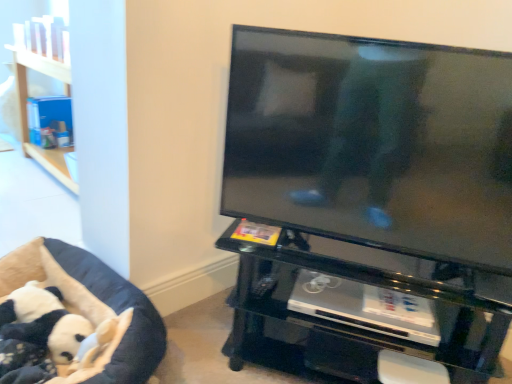
Question: Looking at their shapes, would you say black glass tv stand at center, acting as the 2th furniture starting from the left, is wider or thinner than black plush dog bed at lower left, the second furniture in the right-to-left sequence?

Choices:
 (A) wide
 (B) thin

Answer: (A)

Question: From a real-world perspective, is black glass tv stand at center, acting as the 2th furniture starting from the left, positioned above or below black plush dog bed at lower left, the second furniture in the right-to-left sequence?

Choices:
 (A) above
 (B) below

Answer: (A)

Question: Estimate the real-world distances between objects in this image. Which object is closer to the black glossy tv at upper right?

Choices:
 (A) black glass tv stand at center, acting as the first furniture starting from the right
 (B) black plush dog bed at lower left, placed as the first furniture when sorted from left to right
 (C) black plush panda at lower left

Answer: (A)

Question: Estimate the real-world distances between objects in this image. Which object is farther from the black glossy tv at upper right?

Choices:
 (A) black plush dog bed at lower left, placed as the first furniture when sorted from left to right
 (B) black plush panda at lower left
 (C) black glass tv stand at center, acting as the first furniture starting from the right

Answer: (B)